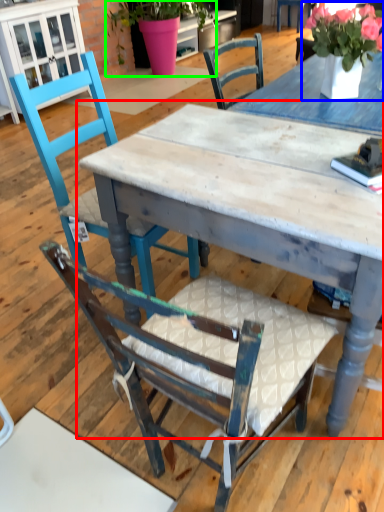
Question: Considering the real-world distances, which object is closest to table (highlighted by a red box)? floral arrangement (highlighted by a blue box) or houseplant (highlighted by a green box).

Choices:
 (A) floral arrangement
 (B) houseplant

Answer: (A)